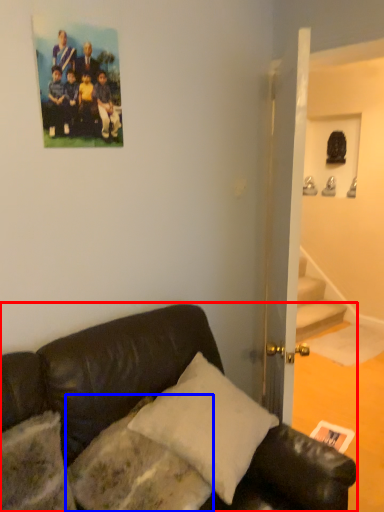
Question: Which object is closer to the camera taking this photo, studio couch (highlighted by a red box) or pillow (highlighted by a blue box)?

Choices:
 (A) studio couch
 (B) pillow

Answer: (A)